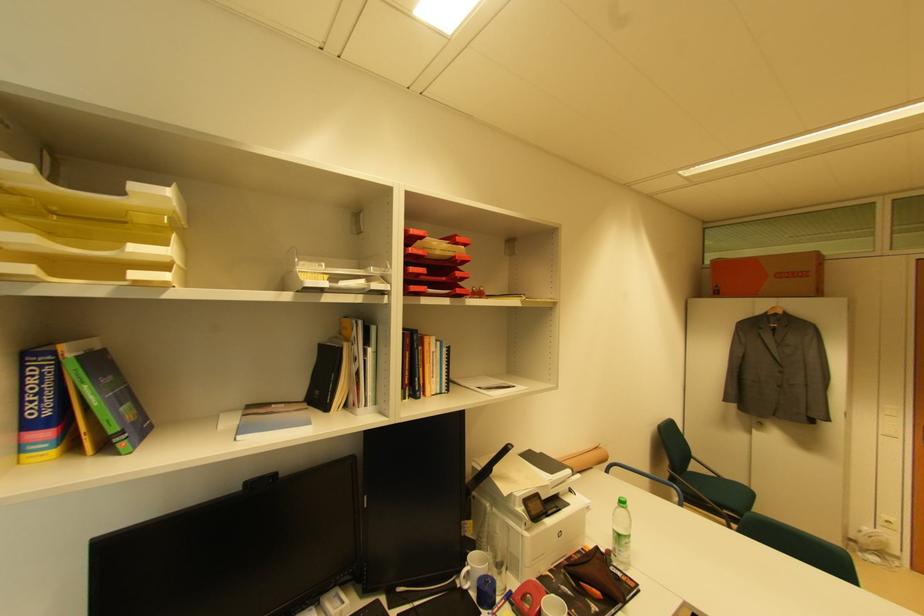
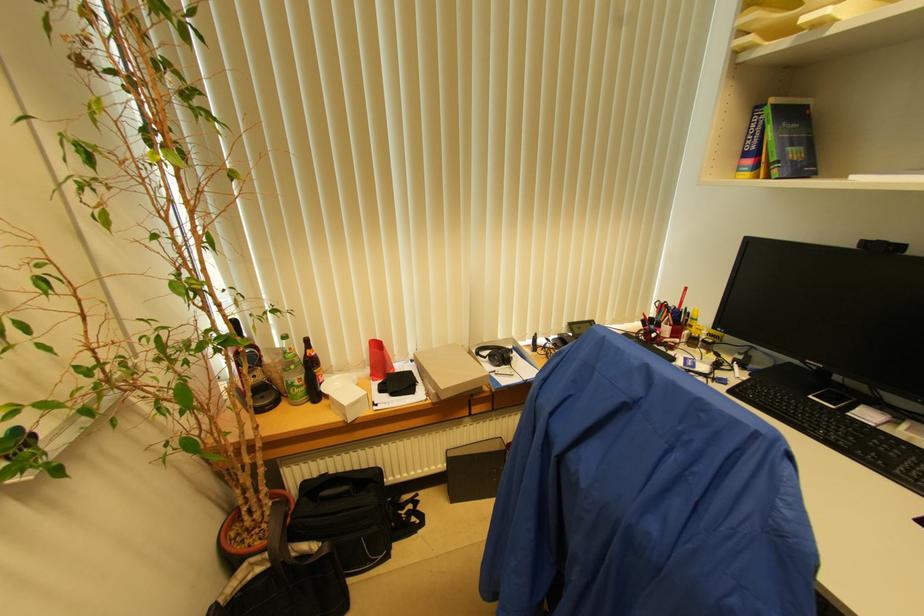
Where in the second image is the point corresponding to pixel 126 435 from the first image?

(780, 166)